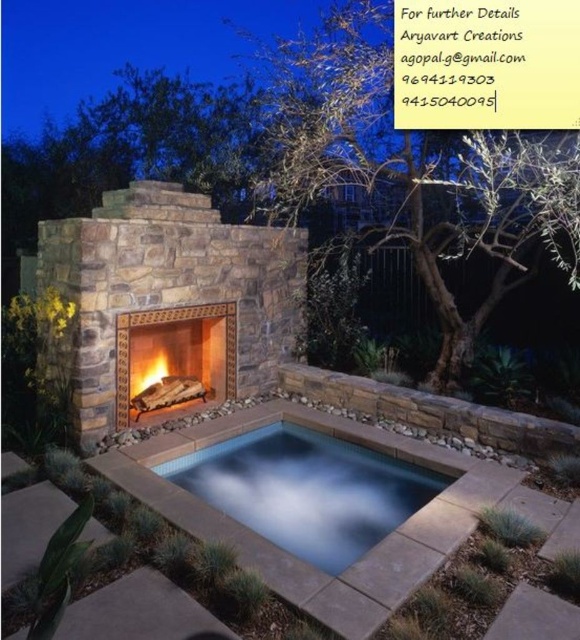
Between clear glass pool at center and matte stone fireplace at center, which one has more height?

With more height is matte stone fireplace at center.

Is clear glass pool at center wider than matte stone fireplace at center?

Yes.

Image resolution: width=580 pixels, height=640 pixels. Identify the location of clear glass pool at center. (306, 490).

Find the location of a particular element. The image size is (580, 640). clear glass pool at center is located at coordinates (306, 490).